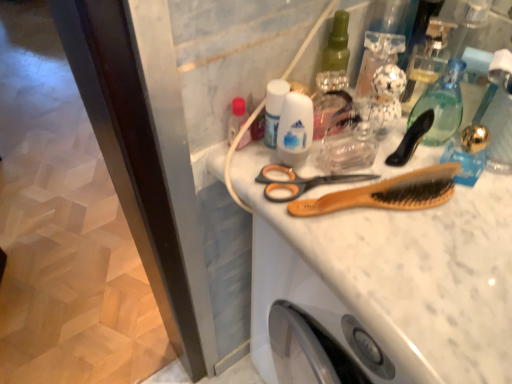
Identify the location of white matte deodorant at center, the 2th toiletry in the left-to-right sequence. This screenshot has height=384, width=512. (295, 129).

This screenshot has height=384, width=512. Describe the element at coordinates (236, 118) in the screenshot. I see `matte plastic bottle at upper left, the first toiletry viewed from the left` at that location.

What do you see at coordinates (389, 279) in the screenshot?
I see `white marble counter top at upper right` at bounding box center [389, 279].

Measure the distance between white glossy mouthwash at center, which appears as the 2th mouthwash when viewed from the right, and camera.

A distance of 21.79 inches exists between white glossy mouthwash at center, which appears as the 2th mouthwash when viewed from the right, and camera.

This screenshot has height=384, width=512. What do you see at coordinates (387, 193) in the screenshot?
I see `wooden comb at center` at bounding box center [387, 193].

Describe the element at coordinates (301, 182) in the screenshot. This screenshot has width=512, height=384. I see `orange plastic scissors at center` at that location.

The height and width of the screenshot is (384, 512). What do you see at coordinates (442, 104) in the screenshot?
I see `translucent glass mouthwash at upper right, the 2th mouthwash when ordered from left to right` at bounding box center [442, 104].

Where is `translucent glass mouthwash at upper right, the first mouthwash in the right-to-left sequence`? translucent glass mouthwash at upper right, the first mouthwash in the right-to-left sequence is located at coordinates (442, 104).

At what (x,y) coordinates should I click in order to perform the action: click on white matte deodorant at center, the 2th toiletry in the left-to-right sequence. Please return your answer as a coordinate pair (x, y). The height and width of the screenshot is (384, 512). Looking at the image, I should click on (295, 129).

Based on the photo, from a real-world perspective, is black plastic brush at upper right located higher than wooden comb at center?

Yes, from a real-world perspective, black plastic brush at upper right is on top of wooden comb at center.

Considering the sizes of black plastic brush at upper right and wooden comb at center in the image, is black plastic brush at upper right taller or shorter than wooden comb at center?

Clearly, black plastic brush at upper right is taller compared to wooden comb at center.

Is black plastic brush at upper right far from wooden comb at center?

No, there isn't a large distance between black plastic brush at upper right and wooden comb at center.

Considering the sizes of white glossy mouthwash at center, which appears as the 2th mouthwash when viewed from the right, and white matte deodorant at center, the 2th toiletry in the left-to-right sequence, in the image, is white glossy mouthwash at center, which appears as the 2th mouthwash when viewed from the right, taller or shorter than white matte deodorant at center, the 2th toiletry in the left-to-right sequence,?

white glossy mouthwash at center, which appears as the 2th mouthwash when viewed from the right, is shorter than white matte deodorant at center, the 2th toiletry in the left-to-right sequence.

Considering the positions of point (275, 132) and point (298, 166), is point (275, 132) closer or farther from the camera than point (298, 166)?

Point (275, 132) is positioned farther from the camera compared to point (298, 166).

From the picture: From a real-world perspective, who is located lower, white glossy mouthwash at center, which appears as the 2th mouthwash when viewed from the right, or white matte deodorant at center, the 2th toiletry in the left-to-right sequence?

white glossy mouthwash at center, which appears as the 2th mouthwash when viewed from the right, is physically lower.

From the picture: Is white glossy mouthwash at center, which appears as the 2th mouthwash when viewed from the right, facing towards white matte deodorant at center, the 2th toiletry in the left-to-right sequence?

No, white glossy mouthwash at center, which appears as the 2th mouthwash when viewed from the right, is not facing towards white matte deodorant at center, the 2th toiletry in the left-to-right sequence.

From the image's perspective, does translucent glass mouthwash at upper right, the 2th mouthwash when ordered from left to right, appear higher than orange plastic scissors at center?

Yes, from the image's perspective, translucent glass mouthwash at upper right, the 2th mouthwash when ordered from left to right, is above orange plastic scissors at center.

Considering their positions, is translucent glass mouthwash at upper right, the first mouthwash in the right-to-left sequence, located in front of or behind orange plastic scissors at center?

translucent glass mouthwash at upper right, the first mouthwash in the right-to-left sequence, is in front of orange plastic scissors at center.

Based on the photo, is translucent glass mouthwash at upper right, the first mouthwash in the right-to-left sequence, placed right next to orange plastic scissors at center?

translucent glass mouthwash at upper right, the first mouthwash in the right-to-left sequence, and orange plastic scissors at center are clearly separated.

Which of these two, translucent glass mouthwash at upper right, the 2th mouthwash when ordered from left to right, or orange plastic scissors at center, stands taller?

With more height is translucent glass mouthwash at upper right, the 2th mouthwash when ordered from left to right.

Between translucent glass mouthwash at upper right, the first mouthwash in the right-to-left sequence, and white matte deodorant at center, the 2th toiletry in the left-to-right sequence, which one appears on the left side from the viewer's perspective?

From the viewer's perspective, white matte deodorant at center, the 2th toiletry in the left-to-right sequence, appears more on the left side.

Can you tell me how much translucent glass mouthwash at upper right, the first mouthwash in the right-to-left sequence, and white matte deodorant at center, acting as the 1th toiletry starting from the right, differ in facing direction?

They differ by 17.5 degrees in their facing directions.

Find the location of a particular element. This screenshot has height=384, width=512. the 2nd toiletry below the translucent glass mouthwash at upper right, the 2th mouthwash when ordered from left to right (from the image's perspective) is located at coordinates (295, 129).

Is translucent glass mouthwash at upper right, the 2th mouthwash when ordered from left to right, smaller than white matte deodorant at center, the 2th toiletry in the left-to-right sequence?

No, translucent glass mouthwash at upper right, the 2th mouthwash when ordered from left to right, is not smaller than white matte deodorant at center, the 2th toiletry in the left-to-right sequence.

From the image's perspective, would you say orange plastic scissors at center is positioned over matte plastic bottle at upper left, the first toiletry viewed from the left?

Incorrect, from the image's perspective, orange plastic scissors at center is lower than matte plastic bottle at upper left, the first toiletry viewed from the left.

Considering the positions of points (283, 188) and (234, 116), is point (283, 188) farther from camera compared to point (234, 116)?

No, it is in front of (234, 116).

How far apart are orange plastic scissors at center and matte plastic bottle at upper left, marked as the second toiletry in a right-to-left arrangement?

orange plastic scissors at center is 10.27 centimeters from matte plastic bottle at upper left, marked as the second toiletry in a right-to-left arrangement.

Is orange plastic scissors at center not inside matte plastic bottle at upper left, the first toiletry viewed from the left?

Yes, orange plastic scissors at center is located beyond the bounds of matte plastic bottle at upper left, the first toiletry viewed from the left.

Consider the image. Is matte plastic bottle at upper left, the first toiletry viewed from the left, touching black plastic brush at upper right?

matte plastic bottle at upper left, the first toiletry viewed from the left, and black plastic brush at upper right are clearly separated.

From the image's perspective, between matte plastic bottle at upper left, marked as the second toiletry in a right-to-left arrangement, and black plastic brush at upper right, which one is located above?

matte plastic bottle at upper left, marked as the second toiletry in a right-to-left arrangement, is shown above in the image.

Can you confirm if matte plastic bottle at upper left, the first toiletry viewed from the left, is smaller than black plastic brush at upper right?

Yes.

Is white matte deodorant at center, the 2th toiletry in the left-to-right sequence, turned away from orange plastic scissors at center?

white matte deodorant at center, the 2th toiletry in the left-to-right sequence, does not have its back to orange plastic scissors at center.

From a real-world perspective, which toiletry is the 2nd one above the orange plastic scissors at center? Please provide its 2D coordinates.

[(295, 129)]

Is white matte deodorant at center, acting as the 1th toiletry starting from the right, shorter than orange plastic scissors at center?

No.

What's the angular difference between white matte deodorant at center, the 2th toiletry in the left-to-right sequence, and orange plastic scissors at center's facing directions?

The angular difference between white matte deodorant at center, the 2th toiletry in the left-to-right sequence, and orange plastic scissors at center is 10.6 degrees.

You are a GUI agent. You are given a task and a screenshot of the screen. Output one action in this format:
    pyautogui.click(x=<x>, y=<y>)
    Task: Click on the comb in front of the black plastic brush at upper right
    This screenshot has height=384, width=512.
    Given the screenshot: What is the action you would take?
    (x=387, y=193)

From the image's perspective, starting from the white glossy mouthwash at center, which appears as the 2th mouthwash when viewed from the right, which toiletry is the 2nd one below? Please provide its 2D coordinates.

[(295, 129)]

When comparing their distances from white marble counter top at upper right, does wooden comb at center or matte plastic bottle at upper left, marked as the second toiletry in a right-to-left arrangement, seem further?

matte plastic bottle at upper left, marked as the second toiletry in a right-to-left arrangement.

Looking at the image, which one is located closer to white marble counter top at upper right, wooden comb at center or black plastic brush at upper right?

The object closer to white marble counter top at upper right is wooden comb at center.

Considering their positions, is matte plastic bottle at upper left, marked as the second toiletry in a right-to-left arrangement, positioned closer to orange plastic scissors at center than white marble counter top at upper right?

The object closer to orange plastic scissors at center is matte plastic bottle at upper left, marked as the second toiletry in a right-to-left arrangement.

Based on their spatial positions, is translucent glass mouthwash at upper right, the 2th mouthwash when ordered from left to right, or white glossy mouthwash at center, which appears as the 2th mouthwash when viewed from the right, further from white matte deodorant at center, the 2th toiletry in the left-to-right sequence?

translucent glass mouthwash at upper right, the 2th mouthwash when ordered from left to right, is positioned further to the anchor white matte deodorant at center, the 2th toiletry in the left-to-right sequence.

When comparing their distances from white marble counter top at upper right, does black plastic brush at upper right or translucent glass mouthwash at upper right, the first mouthwash in the right-to-left sequence, seem further?

translucent glass mouthwash at upper right, the first mouthwash in the right-to-left sequence, lies further to white marble counter top at upper right than the other object.

Which object lies nearer to the anchor point translucent glass mouthwash at upper right, the first mouthwash in the right-to-left sequence, white marble counter top at upper right or white glossy mouthwash at center, which appears as the 2th mouthwash when viewed from the right?

white marble counter top at upper right lies closer to translucent glass mouthwash at upper right, the first mouthwash in the right-to-left sequence, than the other object.

Looking at the image, which one is located further to white glossy mouthwash at center, which appears as the 1th mouthwash when viewed from the left, black plastic brush at upper right or white matte deodorant at center, the 2th toiletry in the left-to-right sequence?

black plastic brush at upper right.

In the scene shown: Considering their positions, is wooden comb at center positioned further to orange plastic scissors at center than translucent glass mouthwash at upper right, the 2th mouthwash when ordered from left to right?

Among the two, translucent glass mouthwash at upper right, the 2th mouthwash when ordered from left to right, is located further to orange plastic scissors at center.

Where is `toiletry between white glossy mouthwash at center, which appears as the 2th mouthwash when viewed from the right, and translucent glass mouthwash at upper right, the 2th mouthwash when ordered from left to right, from left to right`? This screenshot has height=384, width=512. toiletry between white glossy mouthwash at center, which appears as the 2th mouthwash when viewed from the right, and translucent glass mouthwash at upper right, the 2th mouthwash when ordered from left to right, from left to right is located at coordinates (295, 129).

Identify the location of toiletry between matte plastic bottle at upper left, the first toiletry viewed from the left, and white marble counter top at upper right vertically. Image resolution: width=512 pixels, height=384 pixels. (295, 129).

Locate an element on the screen. This screenshot has height=384, width=512. toiletry between black plastic brush at upper right and white marble counter top at upper right in the vertical direction is located at coordinates (295, 129).

The width and height of the screenshot is (512, 384). In order to click on brush between translucent glass mouthwash at upper right, the 2th mouthwash when ordered from left to right, and white marble counter top at upper right from top to bottom in this screenshot , I will do tap(411, 139).